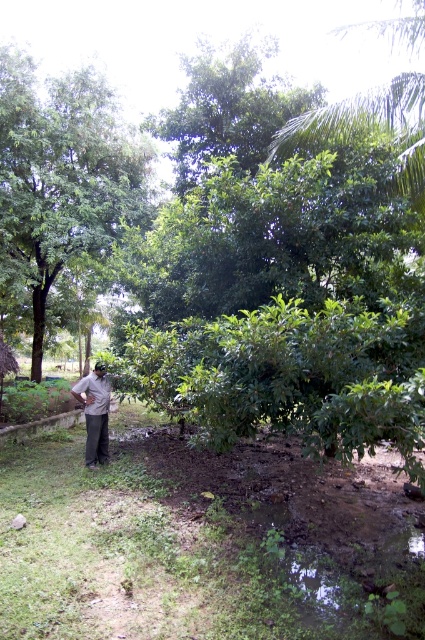
Question: Among these points, which one is farthest from the camera?

Choices:
 (A) (78, 384)
 (B) (36, 125)

Answer: (B)

Question: Can you confirm if green leafy tree at left is smaller than dark brown fabric at lower left?

Choices:
 (A) yes
 (B) no

Answer: (B)

Question: Is green leafy tree at left to the right of dark brown fabric at lower left from the viewer's perspective?

Choices:
 (A) yes
 (B) no

Answer: (B)

Question: Which point appears closest to the camera in this image?

Choices:
 (A) (101, 394)
 (B) (53, 232)

Answer: (A)

Question: Can you confirm if green leafy tree at left is positioned below dark brown fabric at lower left?

Choices:
 (A) yes
 (B) no

Answer: (B)